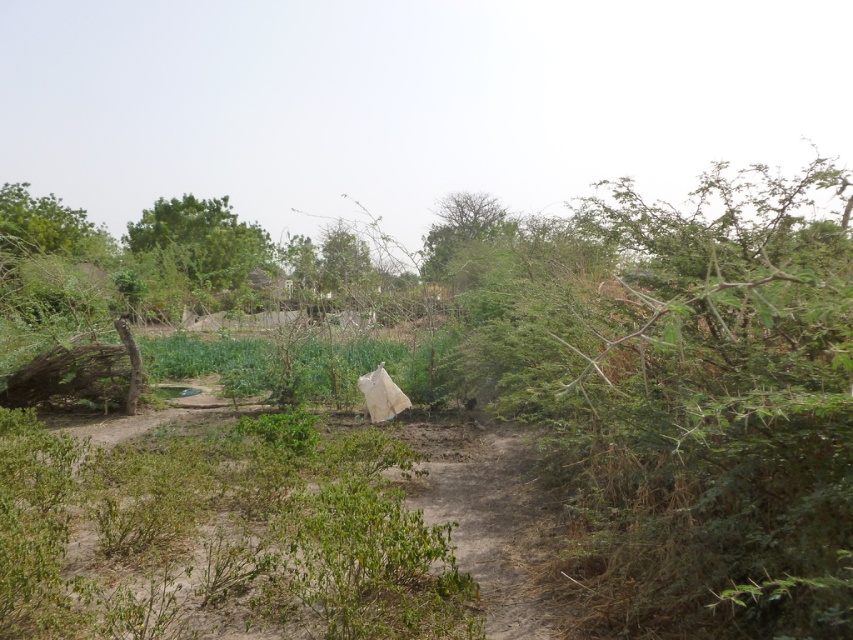
You are standing in the middle of the scene and want to take a photo of both the green leafy tree at upper left and the green leafy tree at center. Which tree should you position closer to the front to include both in the frame without one blocking the other?

To include both the green leafy tree at upper left and the green leafy tree at center in the frame without one blocking the other, you should position the green leafy tree at upper left closer to the front since the green leafy tree at center is behind it.

You are a hiker standing at the camera position in this scene. You need to reach a water source that is located exactly behind the green leafy tree at upper left. If you start walking straight towards the tree, how far will you have to walk to reach the water source?

The distance of green leafy tree at upper left from camera is 28.10 meters. Therefore, you will have to walk approximately 28.10 meters straight towards the green leafy tree at upper left to reach the water source located behind it.

You are standing at the point marked as point (202, 237) in the image. What is the nearest object to you?

The nearest object to point (202, 237) is the green leafy tree at upper left since the point is located on it.